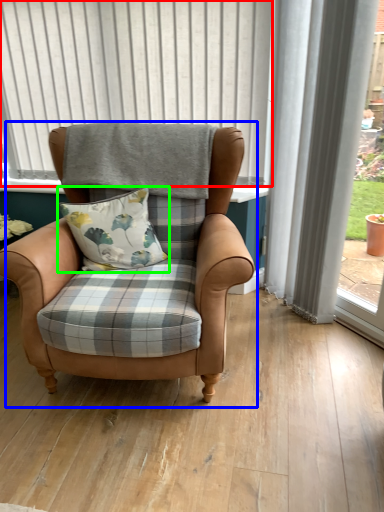
Question: Based on their relative distances, which object is nearer to bay window (highlighted by a red box)? Choose from chair (highlighted by a blue box) and pillow (highlighted by a green box).

Choices:
 (A) chair
 (B) pillow

Answer: (A)